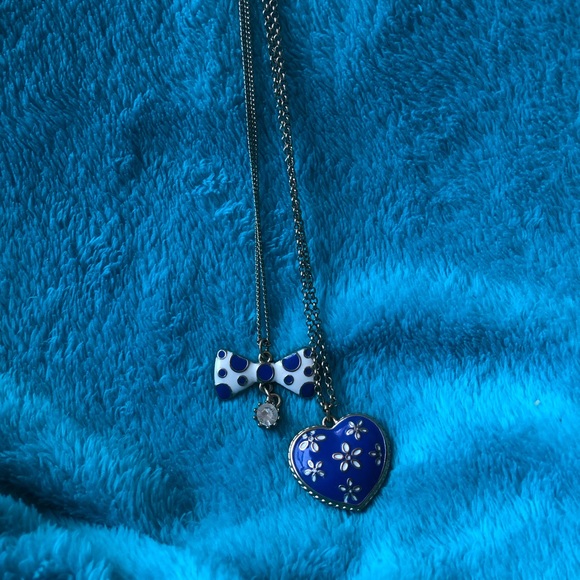
The width and height of the screenshot is (580, 580). What are the coordinates of `blanket` in the screenshot? It's located at (498, 356).